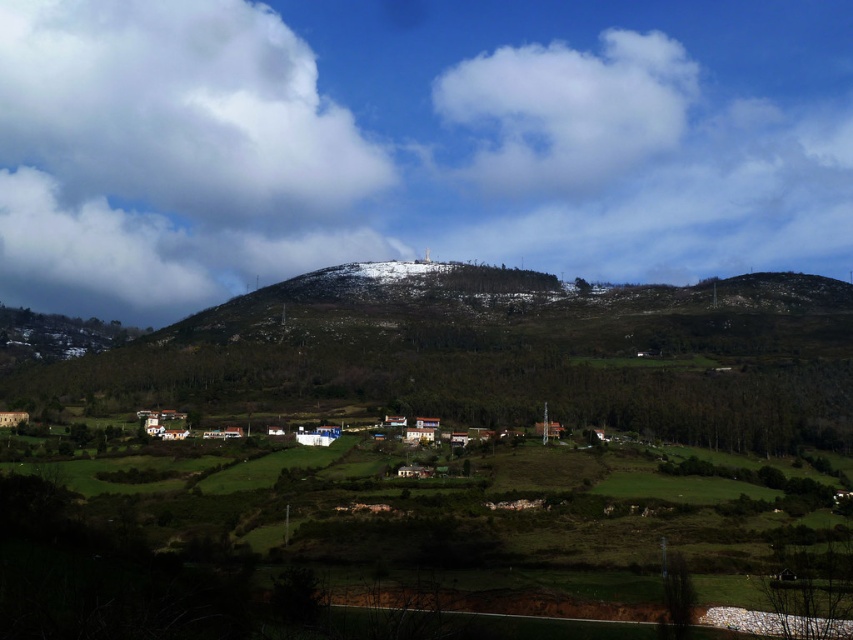
You are a pilot flying an airplane and want to avoid the white fluffy cloud at upper left. What coordinate should you aim for to navigate around it?

The white fluffy cloud at upper left is located at coordinate point (178, 112). To navigate around it, aim for a coordinate slightly to the right or below this point, such as (212, 160) or (254, 96), ensuring a safe distance from the cloud.

In the rural landscape scene, there are two clouds visible in the upper left corner. The first is labeled as the white fluffy cloud at upper left and the second as the cloudy white cloud at upper left. Which of these two clouds is bigger?

The white fluffy cloud at upper left is larger in size compared to the cloudy white cloud at upper left.